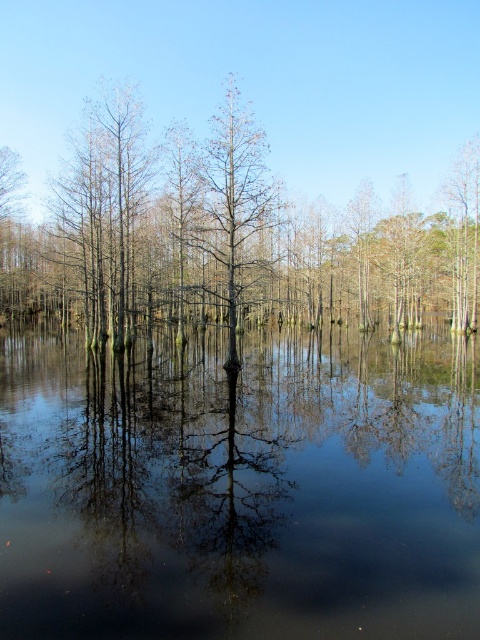
You are a photographer standing at the edge of the swamp. You want to capture a photo where the transparent water at center and the brown matte tree at center are both visible. Which object will appear taller in the photo?

The brown matte tree at center will appear taller in the photo because the transparent water at center is shorter than the brown matte tree at center.